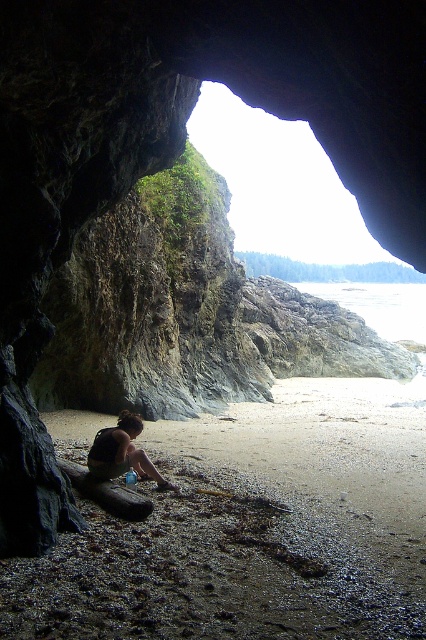
Question: Is sandy beach at lower center thinner than dark brown skin at center?

Choices:
 (A) no
 (B) yes

Answer: (A)

Question: Can you confirm if sandy beach at lower center is positioned to the left of dark brown skin at center?

Choices:
 (A) no
 (B) yes

Answer: (A)

Question: Which point appears farthest from the camera in this image?

Choices:
 (A) (69, 598)
 (B) (117, 467)

Answer: (B)

Question: Does sandy beach at lower center lie behind dark brown skin at center?

Choices:
 (A) no
 (B) yes

Answer: (A)